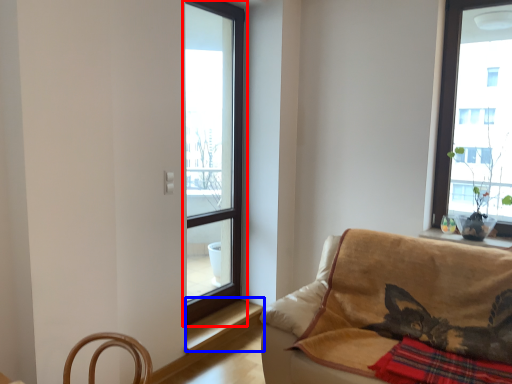
Question: Among these objects, which one is farthest to the camera, window (highlighted by a red box) or window sill (highlighted by a blue box)?

Choices:
 (A) window
 (B) window sill

Answer: (B)